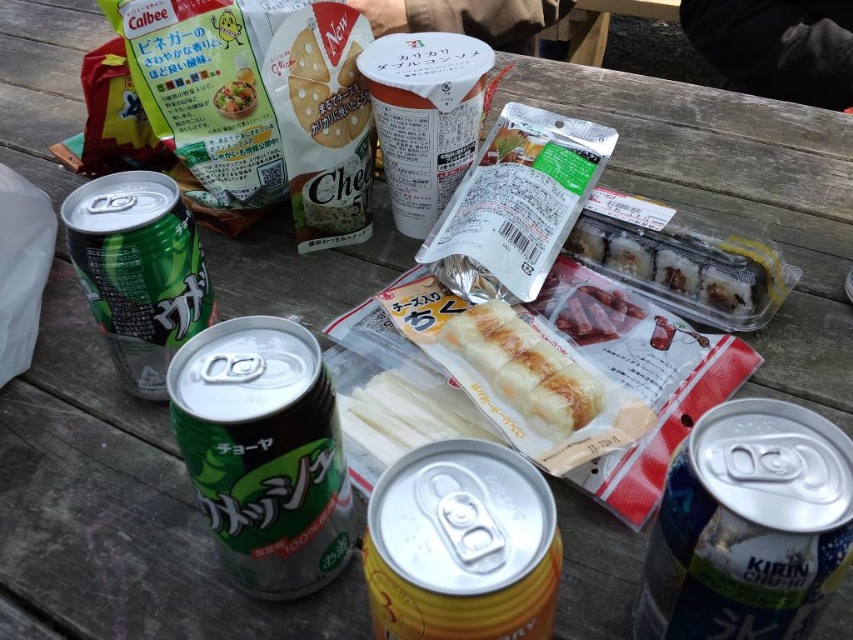
You are standing at the picnic table and want to reach the package of sushi located at point (x=360, y=412). If your arm can extend 18 inches, can you comfortably reach it?

The distance between you and the package of sushi at point (x=360, y=412) is 18.85 inches, which is slightly beyond your arm extension of 18 inches. You might need to lean forward or move closer to comfortably reach it.

You are at a picnic table and need to reach for a drink. There is a blue metallic can at lower right and a green matte can at left. Which can is closer to the edge of the table?

The blue metallic can at lower right is closer to the edge of the table because it is located below the green matte can at left, meaning it is positioned lower and nearer to the edge.